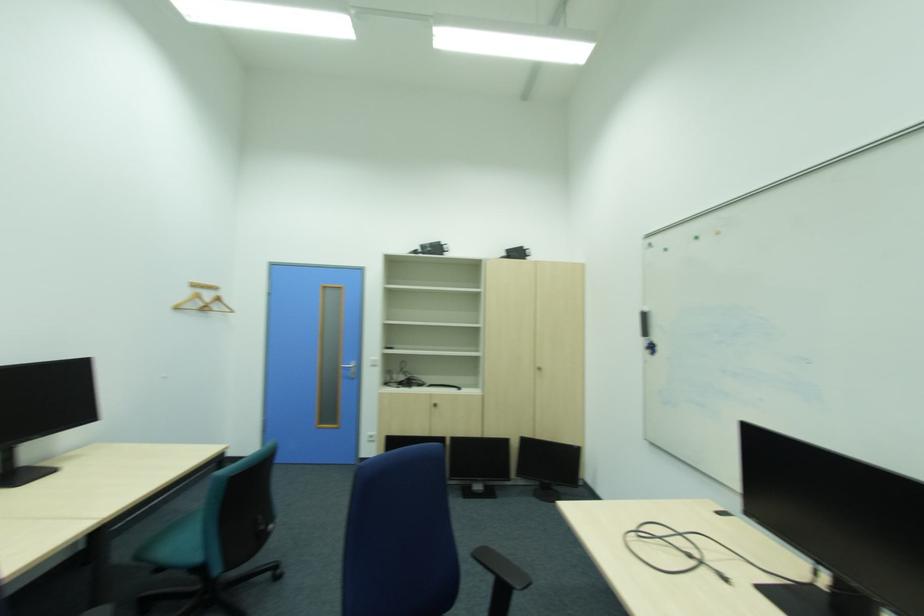
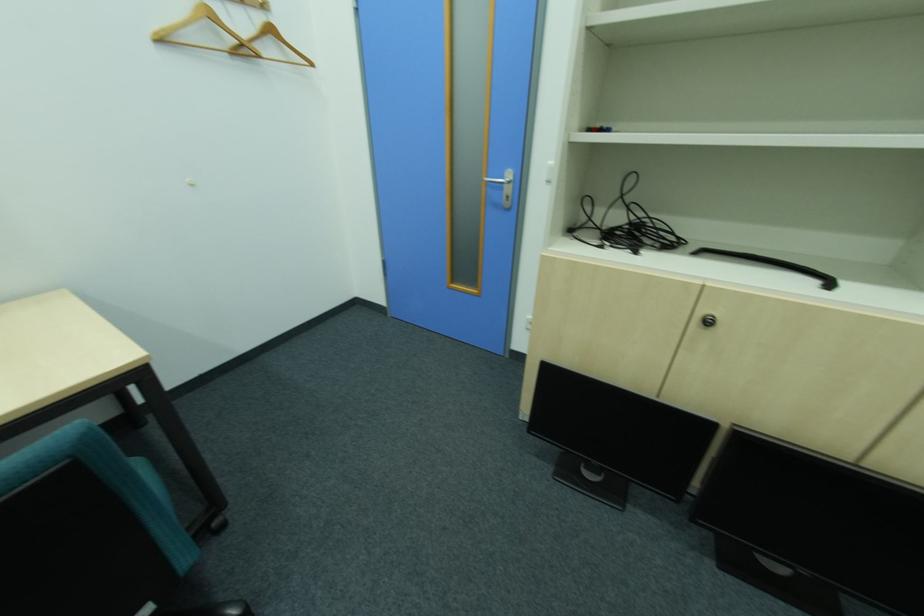
The point at (214,307) is marked in the first image. Where is the corresponding point in the second image?

(249, 45)